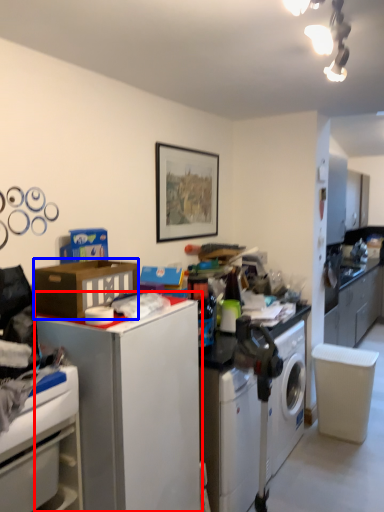
Question: Among these objects, which one is nearest to the camera, file cabinet (highlighted by a red box) or cardboard box (highlighted by a blue box)?

Choices:
 (A) file cabinet
 (B) cardboard box

Answer: (A)